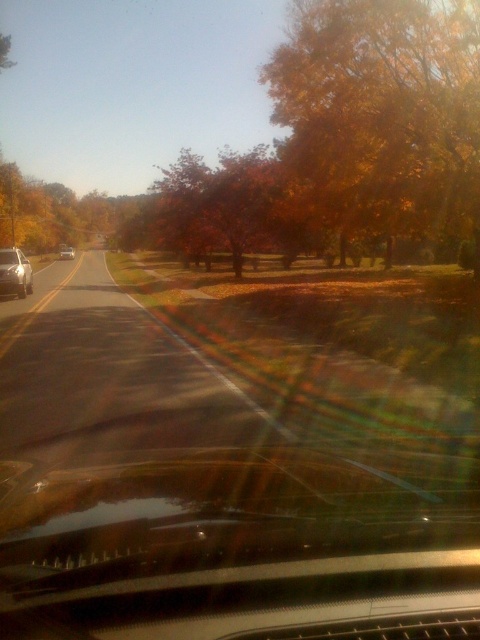
You are driving a car and see the orange leafy tree at center and the silver metallic sedan at left through the windshield. Which object is closer to the left side of the road?

The silver metallic sedan at left is closer to the left side of the road because it is positioned to the left of the orange leafy tree at center.

From the picture: You are sitting in the vehicle and looking through the windshield. There are two points marked on the road ahead. The first point is at coordinate point (238, 262) and the second point is at coordinate point (2, 260). Which point is closer to the vehicle?

Point (2, 260) is closer to the vehicle because it is positioned closer to the camera compared to point (238, 262), which is further away.